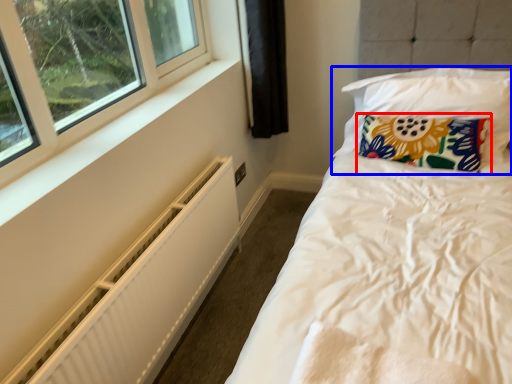
Question: Among these objects, which one is farthest to the camera, pillow (highlighted by a red box) or pillow (highlighted by a blue box)?

Choices:
 (A) pillow
 (B) pillow

Answer: (A)